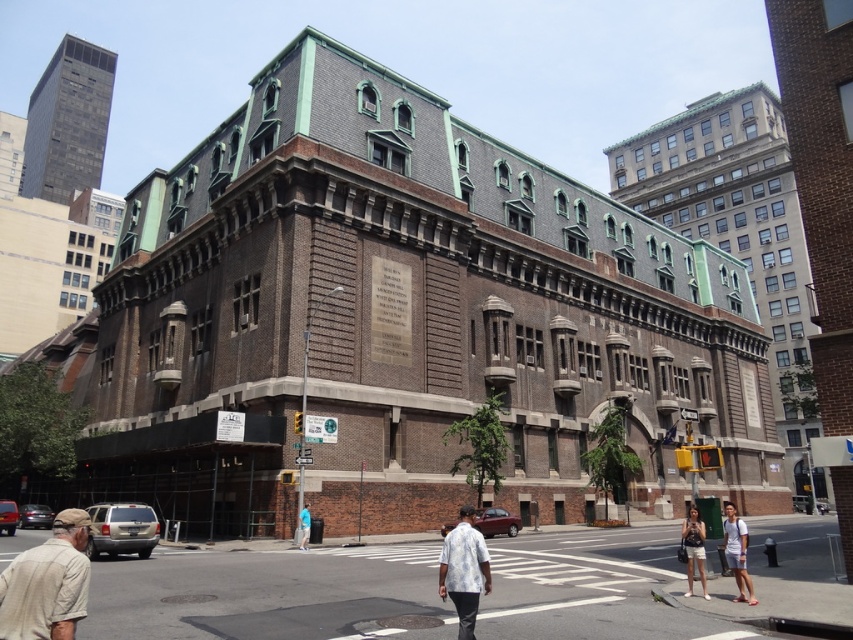
Is beige cotton shirt at lower left bigger than denim shorts at lower right?

Correct, beige cotton shirt at lower left is larger in size than denim shorts at lower right.

Is point (74, 524) less distant than point (688, 516)?

Yes, it is.

I want to click on beige cotton shirt at lower left, so click(47, 582).

Between beige cotton shirt at lower left and light blue denim shorts at lower right, which one is positioned higher?

beige cotton shirt at lower left

Which is more to the right, beige cotton shirt at lower left or light blue denim shorts at lower right?

Positioned to the right is light blue denim shorts at lower right.

Who is more forward, (x=51, y=554) or (x=724, y=548)?

Positioned in front is point (x=51, y=554).

You are a GUI agent. You are given a task and a screenshot of the screen. Output one action in this format:
    pyautogui.click(x=<x>, y=<y>)
    Task: Click on the beige cotton shirt at lower left
    The height and width of the screenshot is (640, 853).
    Given the screenshot: What is the action you would take?
    pyautogui.click(x=47, y=582)

Which is behind, point (476, 580) or point (704, 554)?

The point (704, 554) is behind.

Is point (469, 588) positioned after point (691, 540)?

No.

The image size is (853, 640). What are the coordinates of `white floral shirt at center` in the screenshot? It's located at (463, 570).